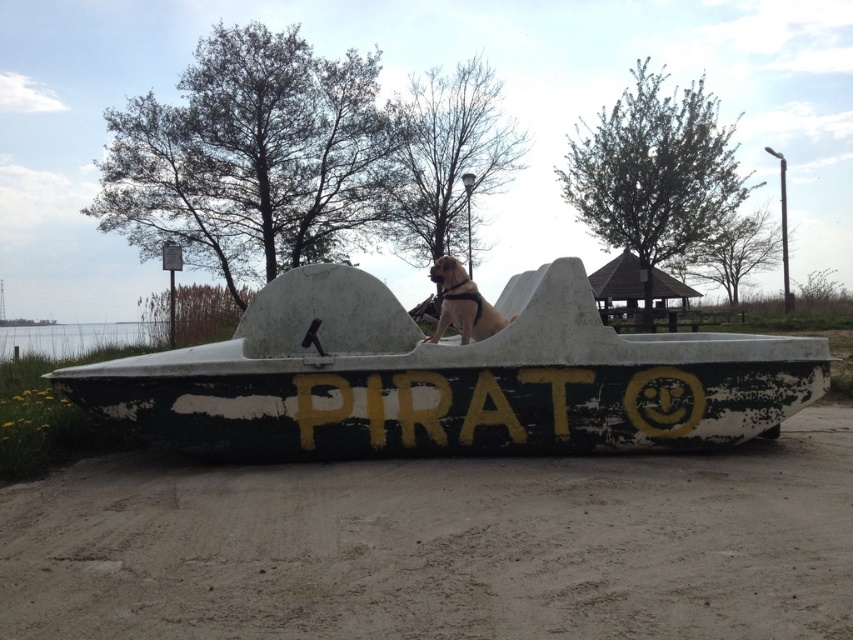
Which is in front, point (741, 541) or point (476, 314)?

Positioned in front is point (741, 541).

Who is lower down, brown textured dirt track at center or golden fur dog at center?

brown textured dirt track at center is lower down.

Measure the distance between point [293,561] and camera.

Point [293,561] is 16.11 feet away from camera.

At what (x,y) coordinates should I click in order to perform the action: click on brown textured dirt track at center. Please return your answer as a coordinate pair (x, y). The height and width of the screenshot is (640, 853). Looking at the image, I should click on (440, 547).

Can you confirm if brown textured dirt track at center is bigger than green weathered boat at center?

Actually, brown textured dirt track at center might be smaller than green weathered boat at center.

Does brown textured dirt track at center have a lesser height compared to green weathered boat at center?

Yes, brown textured dirt track at center is shorter than green weathered boat at center.

Where is `brown textured dirt track at center`? Image resolution: width=853 pixels, height=640 pixels. brown textured dirt track at center is located at coordinates (440, 547).

Can you confirm if green weathered boat at center is smaller than golden fur dog at center?

Indeed, green weathered boat at center has a smaller size compared to golden fur dog at center.

Between point (590, 433) and point (447, 321), which one is positioned behind?

Positioned behind is point (447, 321).

This screenshot has height=640, width=853. Find the location of `green weathered boat at center`. green weathered boat at center is located at coordinates (447, 378).